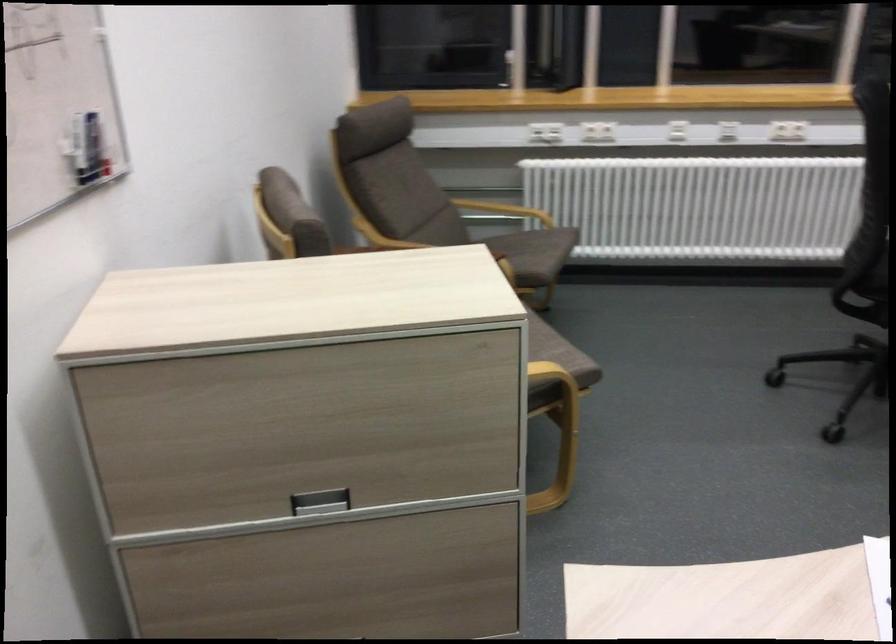
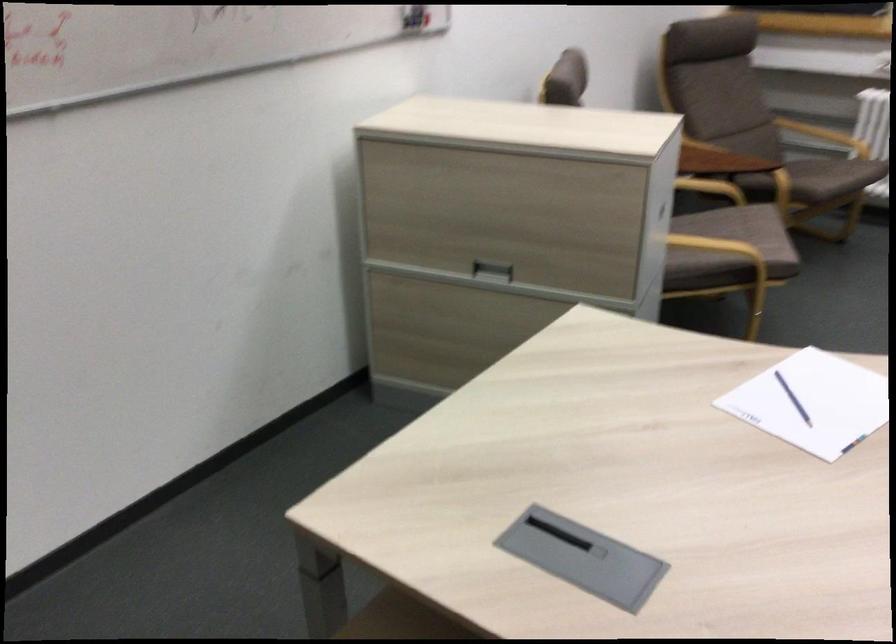
The point at (545, 254) is marked in the first image. Where is the corresponding point in the second image?

(831, 176)